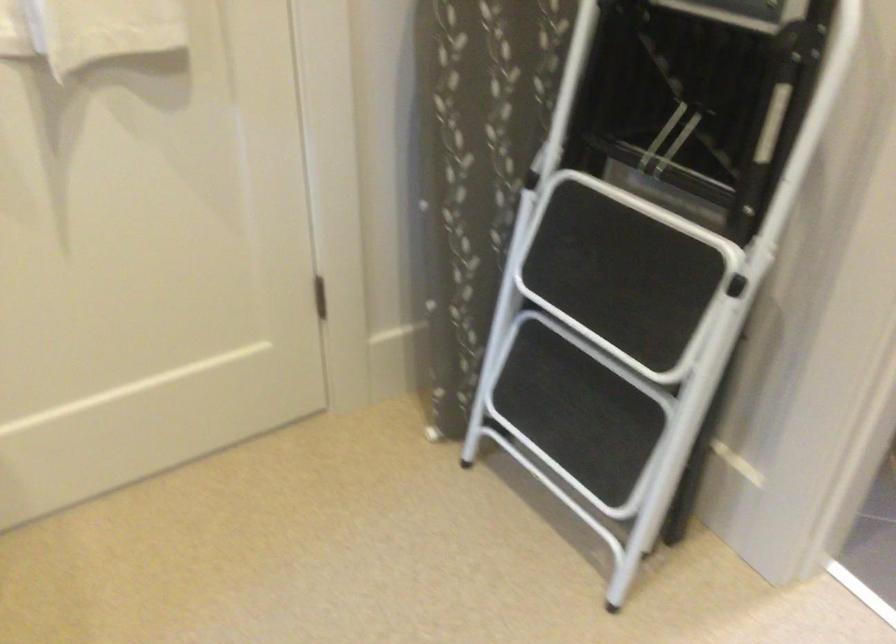
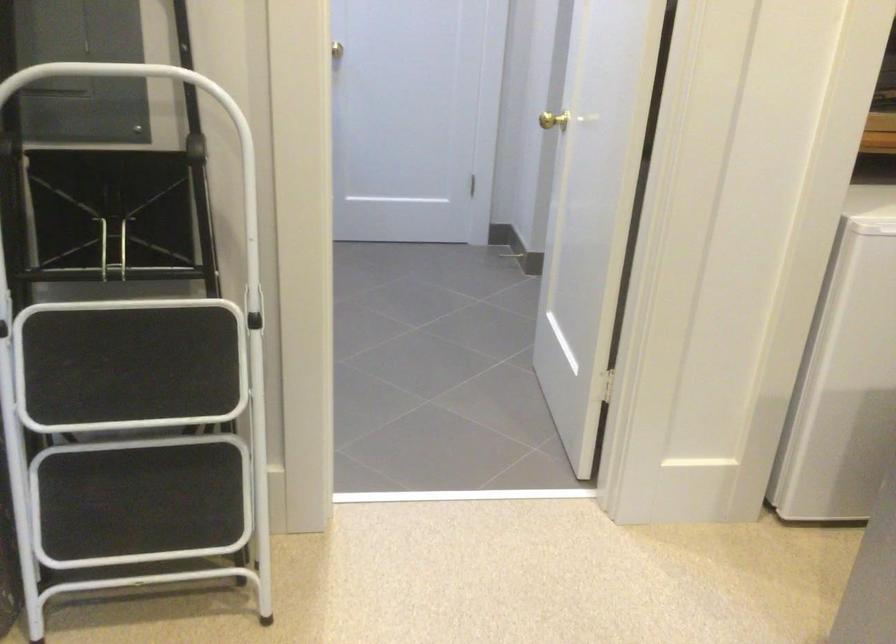
Question: The camera is either moving clockwise (left) or counter-clockwise (right) around the object. The first image is from the beginning of the video and the second image is from the end. Is the camera moving left or right when shooting the video?

Choices:
 (A) Left
 (B) Right

Answer: (A)